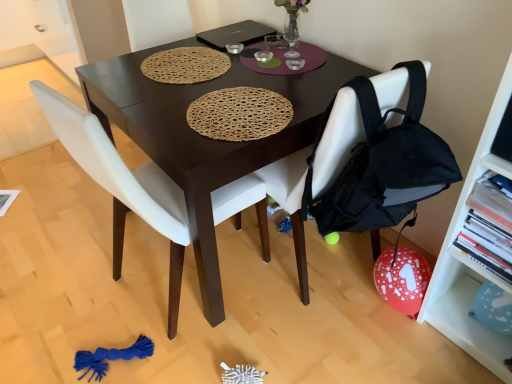
This screenshot has height=384, width=512. I want to click on vacant point to the left of white plastic shelf at right, so click(x=403, y=350).